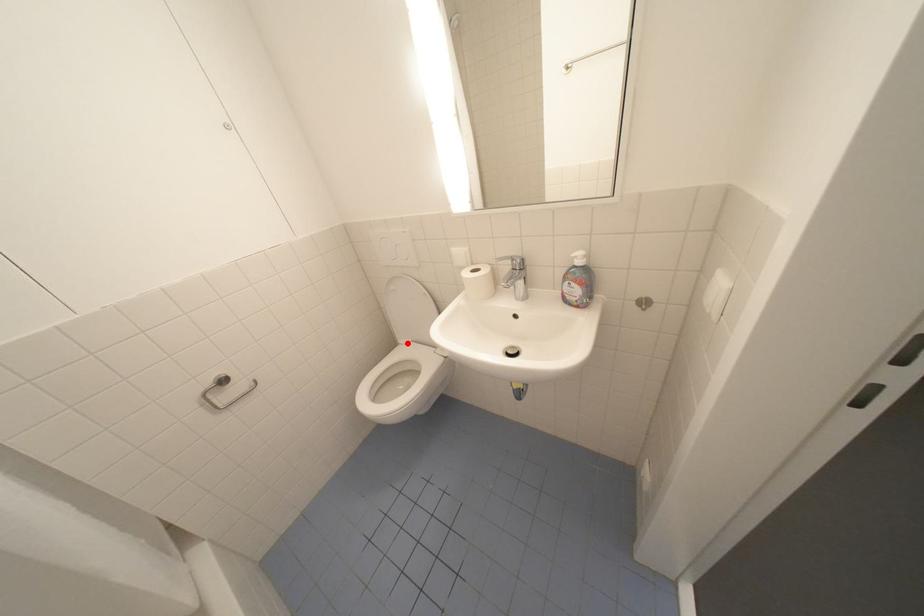
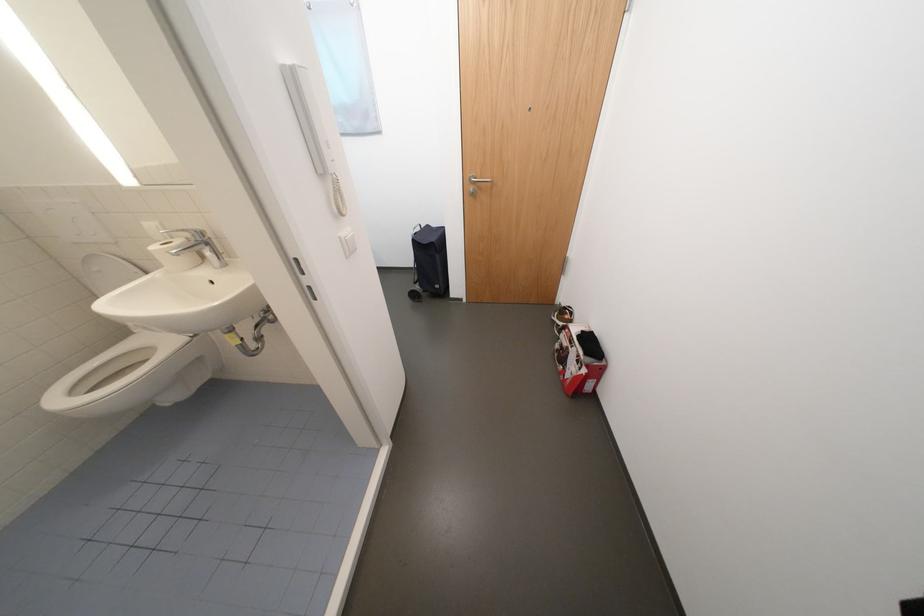
In the second image, find the point that corresponds to the highlighted location in the first image.

(142, 333)